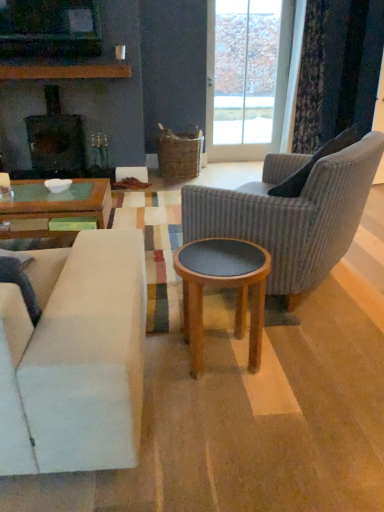
Question: In terms of width, does wooden round stool at center look wider or thinner when compared to dark gray fabric pillow at right?

Choices:
 (A) wide
 (B) thin

Answer: (A)

Question: Choose the correct answer: Is wooden round stool at center inside dark gray fabric pillow at right or outside it?

Choices:
 (A) inside
 (B) outside

Answer: (B)

Question: Estimate the real-world distances between objects in this image. Which object is farther from the matte black fireplace at center?

Choices:
 (A) white glossy bowl at center
 (B) woven brown picnic basket at center
 (C) wooden round stool at center
 (D) ribbed fabric armchair at right
 (E) dark gray fabric pillow at right

Answer: (C)

Question: Which object is the closest to the transparent glass door at upper center?

Choices:
 (A) matte black television at upper left
 (B) ribbed fabric armchair at right
 (C) velvet dark blue curtain at upper right
 (D) dark gray fabric pillow at right
 (E) woven brown picnic basket at center

Answer: (C)